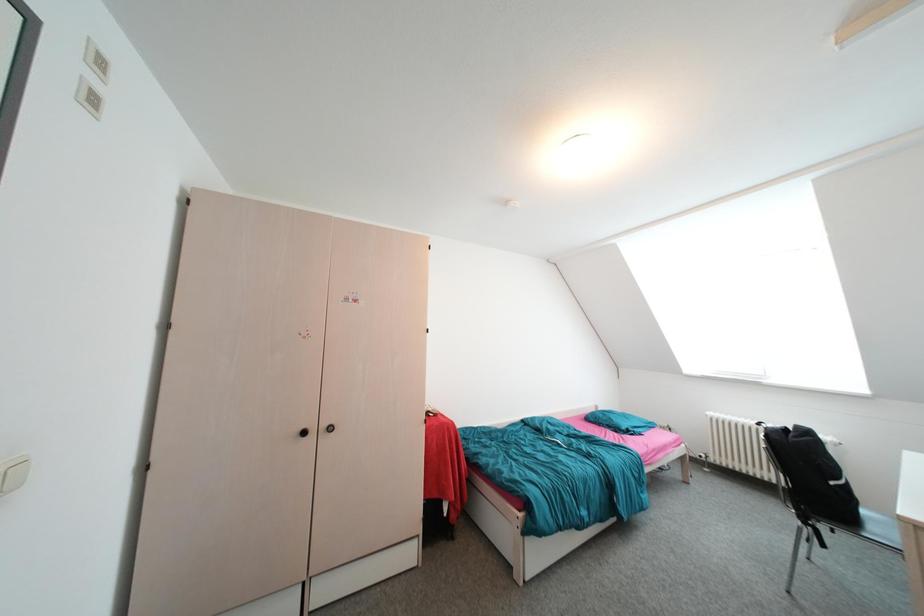
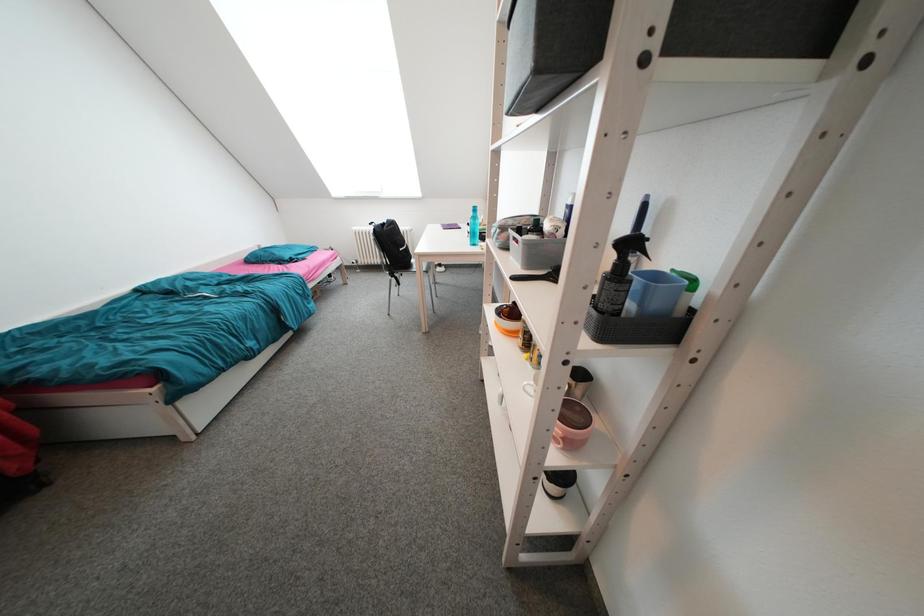
First-person continuous shooting, in which direction is the camera rotating?

The rotation direction of the camera is right-down.